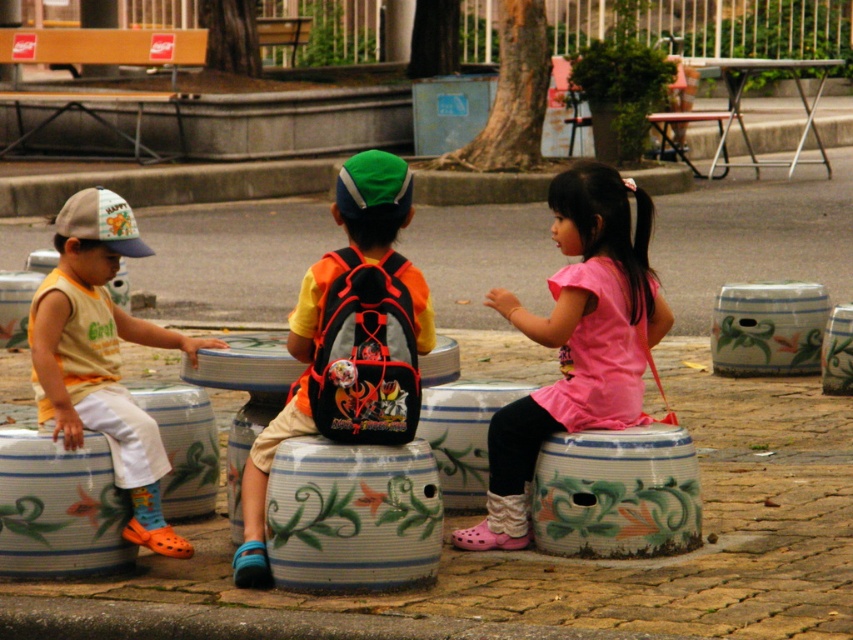
From the picture: You are observing the children sitting on stools. Which child is closer to you, the one wearing the pink fabric dress at center or the one wearing the matte yellow tank top at left?

The pink fabric dress at center is closer to you because it is further to the viewer than the matte yellow tank top at left.

You are a photographer trying to capture a candid shot of the children. You notice the matte orange backpack at center and the pink fabric dress at center. Which object should you focus on if you want to include both in the frame without cropping either?

The matte orange backpack at center is larger than the pink fabric dress at center, so focusing on the matte orange backpack at center would ensure both objects fit within the frame without cropping.